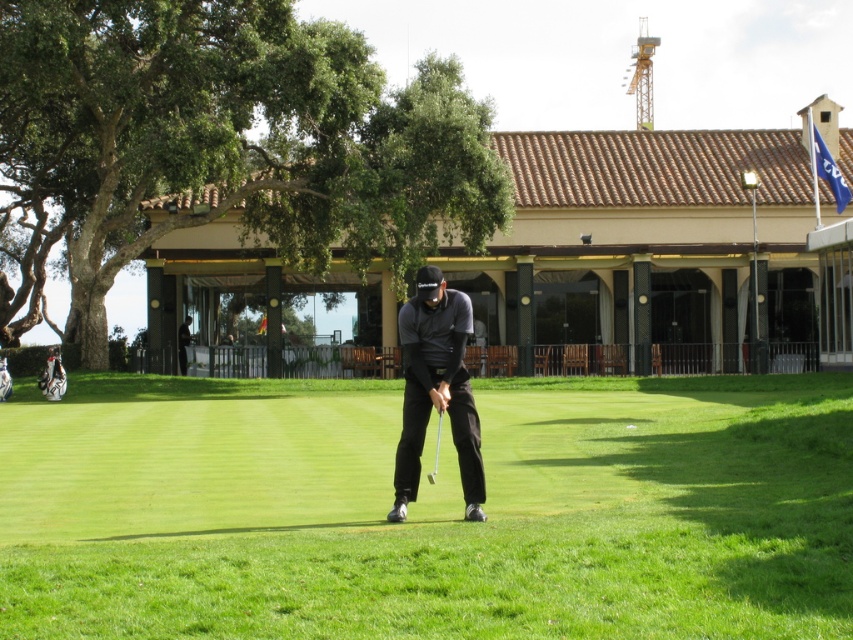
Question: Does green grass at center have a greater width compared to metallic silver golf club at center?

Choices:
 (A) no
 (B) yes

Answer: (B)

Question: Observing the image, what is the correct spatial positioning of green grass at center in reference to black matte golf club at center?

Choices:
 (A) right
 (B) left

Answer: (A)

Question: Among these points, which one is farthest from the camera?

Choices:
 (A) (438, 432)
 (B) (695, 406)

Answer: (B)

Question: Which point appears farthest from the camera in this image?

Choices:
 (A) (438, 436)
 (B) (408, 461)
 (C) (838, 432)

Answer: (C)

Question: Which point appears farthest from the camera in this image?

Choices:
 (A) (44, 515)
 (B) (433, 483)
 (C) (409, 332)

Answer: (A)

Question: Is green grass at center smaller than black matte golf club at center?

Choices:
 (A) yes
 (B) no

Answer: (B)